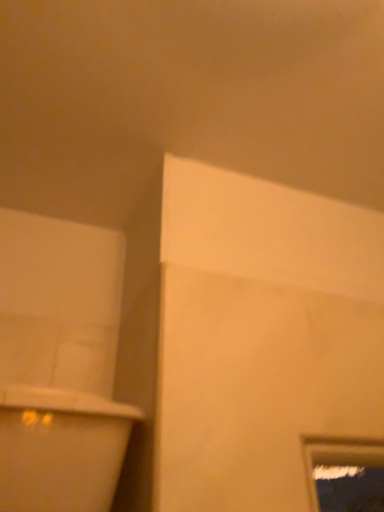
Measure the distance between white matte water tank at lower left and camera.

A distance of 21.85 inches exists between white matte water tank at lower left and camera.

What do you see at coordinates (60, 449) in the screenshot?
I see `white matte water tank at lower left` at bounding box center [60, 449].

Where is `white matte water tank at lower left`? This screenshot has height=512, width=384. white matte water tank at lower left is located at coordinates point(60,449).

Where is `white matte water tank at lower left`? white matte water tank at lower left is located at coordinates (60, 449).